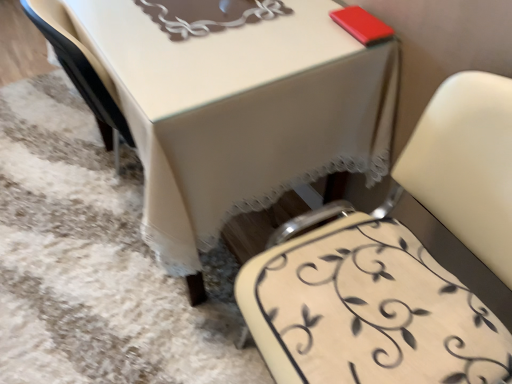
What do you see at coordinates (397, 262) in the screenshot? This screenshot has height=384, width=512. I see `white leather chair at center` at bounding box center [397, 262].

Describe the element at coordinates (242, 109) in the screenshot. I see `white lace tablecloth at center` at that location.

You are a GUI agent. You are given a task and a screenshot of the screen. Output one action in this format:
    pyautogui.click(x=<x>, y=<y>)
    Task: Click on the creamy leather chair at lower right
    Image resolution: width=512 pixels, height=384 pixels.
    Given the screenshot: What is the action you would take?
    pyautogui.click(x=379, y=312)

Where is `white leather chair at center`? white leather chair at center is located at coordinates (397, 262).

In the scene shown: Is creamy leather chair at lower right further to camera compared to white leather chair at center?

Yes, it is.

Which of these two, creamy leather chair at lower right or white leather chair at center, stands shorter?

creamy leather chair at lower right.

From a real-world perspective, is creamy leather chair at lower right physically above white leather chair at center?

Yes, from a real-world perspective, creamy leather chair at lower right is above white leather chair at center.

Who is bigger, creamy leather chair at lower right or white leather chair at center?

white leather chair at center is bigger.

In the scene shown: From a real-world perspective, is white lace tablecloth at center physically above creamy leather chair at lower right?

No, from a real-world perspective, white lace tablecloth at center is not above creamy leather chair at lower right.

How far apart are white lace tablecloth at center and creamy leather chair at lower right?

The distance of white lace tablecloth at center from creamy leather chair at lower right is 14.38 inches.

From the image's perspective, is white lace tablecloth at center located above or below creamy leather chair at lower right?

white lace tablecloth at center is situated higher than creamy leather chair at lower right in the image.

Which object is positioned more to the right, white lace tablecloth at center or creamy leather chair at lower right?

→ creamy leather chair at lower right.

Choose the correct answer: Is white leather chair at center inside creamy leather chair at lower right or outside it?

The correct answer is: outside.

Consider the image. Based on their positions, is white leather chair at center located to the left or right of creamy leather chair at lower right?

In the image, white leather chair at center appears on the right side of creamy leather chair at lower right.

Is white leather chair at center aimed at creamy leather chair at lower right?

Yes, white leather chair at center faces towards creamy leather chair at lower right.

Considering the sizes of objects creamy leather chair at lower right and white lace tablecloth at center in the image provided, who is wider, creamy leather chair at lower right or white lace tablecloth at center?

With larger width is white lace tablecloth at center.

From the image's perspective, relative to white lace tablecloth at center, is creamy leather chair at lower right above or below?

Clearly, from the image's perspective, creamy leather chair at lower right is below white lace tablecloth at center.

From a real-world perspective, is creamy leather chair at lower right on top of white lace tablecloth at center?

Yes, from a real-world perspective, creamy leather chair at lower right is on top of white lace tablecloth at center.

Does white leather chair at center have a larger size compared to white lace tablecloth at center?

Incorrect, white leather chair at center is not larger than white lace tablecloth at center.

From the image's perspective, is white leather chair at center positioned above or below white lace tablecloth at center?

white leather chair at center is below white lace tablecloth at center.

From a real-world perspective, which object stands above the other?

white leather chair at center is physically above.

Is white leather chair at center located outside white lace tablecloth at center?

Yes, white leather chair at center is located beyond the bounds of white lace tablecloth at center.

Is white leather chair at center at the back of white lace tablecloth at center?

That's not correct — white lace tablecloth at center is not looking away from white leather chair at center.

Which of these two, white lace tablecloth at center or white leather chair at center, is smaller?

white leather chair at center is smaller.

From the image's perspective, is white lace tablecloth at center located above or below white leather chair at center?

white lace tablecloth at center is above white leather chair at center.

Is white lace tablecloth at center completely or partially outside of white leather chair at center?

Yes, white lace tablecloth at center is outside of white leather chair at center.

What are the coordinates of `chair directly beneath the creamy leather chair at lower right (from a real-world perspective)` in the screenshot? It's located at (397, 262).

You are a GUI agent. You are given a task and a screenshot of the screen. Output one action in this format:
    pyautogui.click(x=<x>, y=<y>)
    Task: Click on the table above the creamy leather chair at lower right (from the image's perspective)
    
    Given the screenshot: What is the action you would take?
    pyautogui.click(x=242, y=109)

Looking at the image, which one is located further to white lace tablecloth at center, creamy leather chair at lower right or white leather chair at center?

creamy leather chair at lower right is further to white lace tablecloth at center.

From the image, which object appears to be nearer to white leather chair at center, creamy leather chair at lower right or white lace tablecloth at center?

Based on the image, creamy leather chair at lower right appears to be nearer to white leather chair at center.

In the scene shown: When comparing their distances from white lace tablecloth at center, does white leather chair at center or creamy leather chair at lower right seem further?

Based on the image, creamy leather chair at lower right appears to be further to white lace tablecloth at center.

Based on the photo, from the image, which object appears to be nearer to creamy leather chair at lower right, white leather chair at center or white lace tablecloth at center?

white leather chair at center is closer to creamy leather chair at lower right.

Which object lies further to the anchor point creamy leather chair at lower right, white lace tablecloth at center or white leather chair at center?

Among the two, white lace tablecloth at center is located further to creamy leather chair at lower right.

Estimate the real-world distances between objects in this image. Which object is closer to white leather chair at center, white lace tablecloth at center or creamy leather chair at lower right?

creamy leather chair at lower right lies closer to white leather chair at center than the other object.

Where is `design between white lace tablecloth at center and white leather chair at center from top to bottom`? design between white lace tablecloth at center and white leather chair at center from top to bottom is located at coordinates (379, 312).